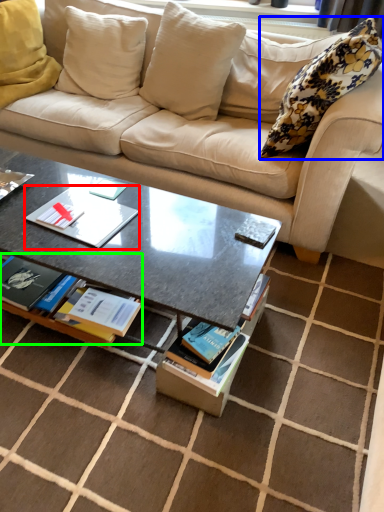
Question: Which object is positioned farthest from paperback book (highlighted by a red box)? Select from pillow (highlighted by a blue box) and book (highlighted by a green box).

Choices:
 (A) pillow
 (B) book

Answer: (A)